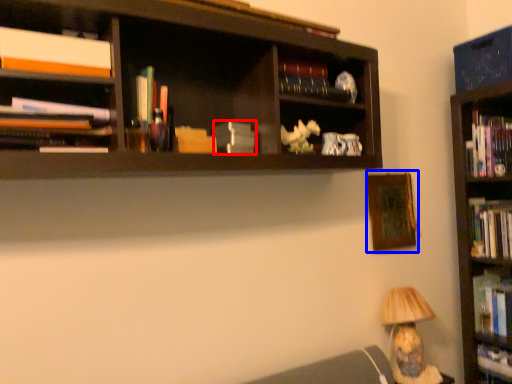
Question: Which point is closer to the camera, paperback book (highlighted by a red box) or picture frame (highlighted by a blue box)?

Choices:
 (A) paperback book
 (B) picture frame

Answer: (A)